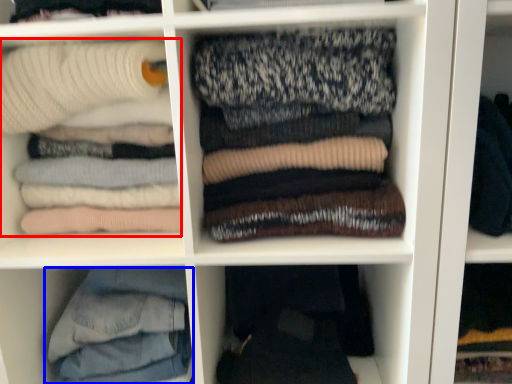
Question: Among these objects, which one is nearest to the camera, laundry (highlighted by a red box) or trousers (highlighted by a blue box)?

Choices:
 (A) laundry
 (B) trousers

Answer: (A)